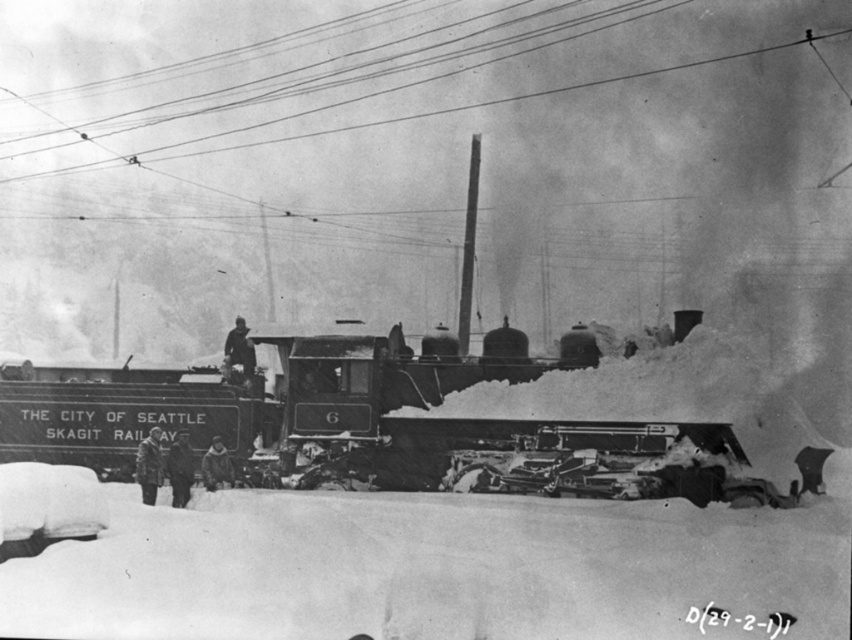
Which is behind, point (803, 481) or point (193, 112)?

Positioned behind is point (193, 112).

Can you confirm if polished steel train at center is positioned to the left of smooth wire at upper center?

Correct, you'll find polished steel train at center to the left of smooth wire at upper center.

Which is behind, point (49, 371) or point (738, 54)?

The point (738, 54) is behind.

This screenshot has height=640, width=852. I want to click on polished steel train at center, so click(x=363, y=426).